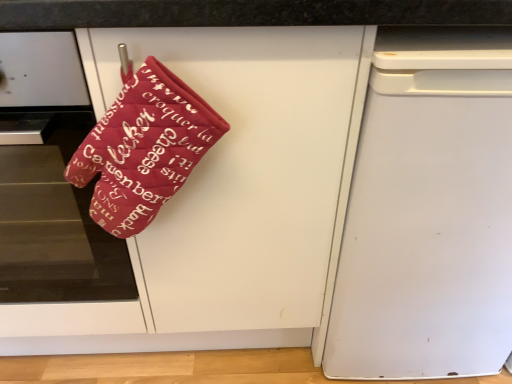
Question: From their relative heights in the image, would you say white matte dishwasher at right is taller or shorter than matte red oven mitt at upper left?

Choices:
 (A) tall
 (B) short

Answer: (B)

Question: Is point (407, 79) positioned closer to the camera than point (224, 329)?

Choices:
 (A) closer
 (B) farther

Answer: (A)

Question: Estimate the real-world distances between objects in this image. Which object is closer to the matte red oven mitt at upper left?

Choices:
 (A) white matte dishwasher at right
 (B) velvet red oven mitt at left

Answer: (A)

Question: Which is nearer to the white matte dishwasher at right?

Choices:
 (A) matte red oven mitt at upper left
 (B) velvet red oven mitt at left

Answer: (A)